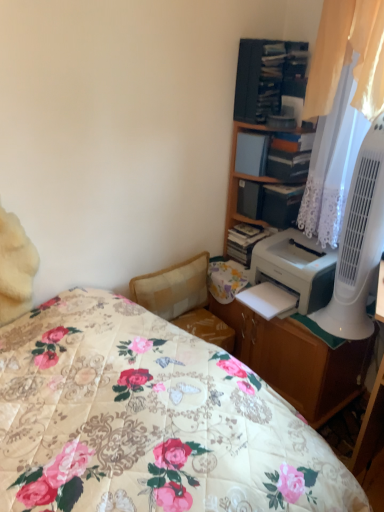
The height and width of the screenshot is (512, 384). Describe the element at coordinates (263, 129) in the screenshot. I see `wooden cabinet at upper right` at that location.

The width and height of the screenshot is (384, 512). In order to click on white lace curtain at upper right in this screenshot , I will do `click(340, 103)`.

Where is `wooden bookshelf at upper right, which appears as the 1th shelf when viewed from the top`? Image resolution: width=384 pixels, height=512 pixels. wooden bookshelf at upper right, which appears as the 1th shelf when viewed from the top is located at coordinates (268, 77).

This screenshot has height=512, width=384. I want to click on wooden cabinet at upper right, so click(x=263, y=129).

From the image's perspective, between white plastic printer at right and hardcover book at upper right, the 1th book viewed from the right, who is located below?

white plastic printer at right is shown below in the image.

Identify the location of printer lying on the left of hardcover book at upper right, the 1th book viewed from the right. (296, 267).

Is the depth of white plastic printer at right less than that of hardcover book at upper right, acting as the 2th book starting from the left?

Yes, it is in front of hardcover book at upper right, acting as the 2th book starting from the left.

Does white plastic printer at right have a greater height compared to hardcover book at upper right, acting as the 2th book starting from the left?

Correct, white plastic printer at right is much taller as hardcover book at upper right, acting as the 2th book starting from the left.

From a real-world perspective, which is physically above, beige fabric swivel chair at center or white plastic fan at right?

white plastic fan at right, from a real-world perspective.

Would you say white plastic fan at right is part of beige fabric swivel chair at center's contents?

No, white plastic fan at right is not inside beige fabric swivel chair at center.

Between beige fabric swivel chair at center and white plastic fan at right, which one appears on the left side from the viewer's perspective?

Positioned to the left is beige fabric swivel chair at center.

Is beige fabric swivel chair at center bigger or smaller than white plastic fan at right?

Clearly, beige fabric swivel chair at center is larger in size than white plastic fan at right.

Can you confirm if wooden cabinet at upper right is taller than beige fabric swivel chair at center?

Indeed, wooden cabinet at upper right has a greater height compared to beige fabric swivel chair at center.

Is wooden cabinet at upper right facing away from beige fabric swivel chair at center?

wooden cabinet at upper right is not turned away from beige fabric swivel chair at center.

Does point (254, 123) appear closer or farther from the camera than point (199, 330)?

Point (254, 123) appears to be closer to the viewer than point (199, 330).

Are wooden bookshelf at upper right, which appears as the second shelf when ordered from the bottom, and white plastic printer at right located far from each other?

No, wooden bookshelf at upper right, which appears as the second shelf when ordered from the bottom, is not far away from white plastic printer at right.

Is point (249, 65) closer or farther from the camera than point (271, 265)?

Clearly, point (249, 65) is closer to the camera than point (271, 265).

From the image's perspective, would you say wooden bookshelf at upper right, which appears as the second shelf when ordered from the bottom, is positioned over white plastic printer at right?

Yes, from the image's perspective, wooden bookshelf at upper right, which appears as the second shelf when ordered from the bottom, is above white plastic printer at right.

Is wooden bookshelf at upper right, which appears as the 1th shelf when viewed from the top, not inside white plastic fan at right?

Answer: Yes, wooden bookshelf at upper right, which appears as the 1th shelf when viewed from the top, is outside of white plastic fan at right.

Considering the relative sizes of wooden bookshelf at upper right, which appears as the second shelf when ordered from the bottom, and white plastic fan at right in the image provided, is wooden bookshelf at upper right, which appears as the second shelf when ordered from the bottom, thinner than white plastic fan at right?

No.

Is point (281, 92) positioned in front of point (373, 178)?

That is False.

Locate an element on the screen. desk located underneath the matte white book at upper right, the first book positioned from the left (from a real-world perspective) is located at coordinates (298, 360).

Considering the positions of objects matte white book at upper right, the first book positioned from the left, and wooden desk at center in the image provided, who is behind, matte white book at upper right, the first book positioned from the left, or wooden desk at center?

matte white book at upper right, the first book positioned from the left, is further from the camera.

From a real-world perspective, which is physically below, matte white book at upper right, the 2th book viewed from the right, or wooden desk at center?

From a 3D spatial view, wooden desk at center is below.

From the image's perspective, relative to wooden desk at center, is matte white book at upper right, the 2th book viewed from the right, above or below?

From the image's perspective, matte white book at upper right, the 2th book viewed from the right, appears above wooden desk at center.

Who is bigger, beige fabric swivel chair at center or wooden cabinet at upper right?

beige fabric swivel chair at center is bigger.

From a real-world perspective, is beige fabric swivel chair at center on top of wooden cabinet at upper right?

No, from a real-world perspective, beige fabric swivel chair at center is not on top of wooden cabinet at upper right.

Is beige fabric swivel chair at center taller or shorter than wooden cabinet at upper right?

In the image, beige fabric swivel chair at center appears to be shorter than wooden cabinet at upper right.

Consider the image. From the image's perspective, would you say beige fabric swivel chair at center is positioned over wooden cabinet at upper right?

No, from the image's perspective, beige fabric swivel chair at center is not over wooden cabinet at upper right.

The width and height of the screenshot is (384, 512). I want to click on printer that is under the hardcover book at upper right, acting as the 2th book starting from the left (from a real-world perspective), so click(x=296, y=267).

Where is `fan positioned vertically above the beige fabric swivel chair at center (from a real-world perspective)`? Image resolution: width=384 pixels, height=512 pixels. fan positioned vertically above the beige fabric swivel chair at center (from a real-world perspective) is located at coordinates (358, 243).

When comparing their distances from white plastic fan at right, does matte white book at upper right, the first book positioned from the left, or white plastic printer at right seem closer?

Among the two, white plastic printer at right is located nearer to white plastic fan at right.

From the picture: Estimate the real-world distances between objects in this image. Which object is closer to white plastic fan at right, wooden desk at center or beige fabric swivel chair at center?

wooden desk at center lies closer to white plastic fan at right than the other object.

Looking at the image, which one is located closer to white plastic fan at right, wooden bookshelf at upper right, which appears as the second shelf when ordered from the bottom, or white plastic printer at right?

white plastic printer at right is positioned closer to the anchor white plastic fan at right.

Estimate the real-world distances between objects in this image. Which object is closer to white plastic fan at right, white lace curtain at upper right or white plastic printer at right?

white plastic printer at right is closer to white plastic fan at right.

Consider the image. Based on their spatial positions, is wooden cabinet at upper right or wooden bookshelf at upper right, which appears as the 1th shelf when viewed from the top, further from white plastic printer at right?

The object further to white plastic printer at right is wooden bookshelf at upper right, which appears as the 1th shelf when viewed from the top.

From the image, which object appears to be nearer to matte plastic shelf at upper right, marked as the 2th shelf in a top-to-bottom arrangement, wooden cabinet at upper right or white plastic fan at right?

wooden cabinet at upper right is positioned closer to the anchor matte plastic shelf at upper right, marked as the 2th shelf in a top-to-bottom arrangement.

Estimate the real-world distances between objects in this image. Which object is further from matte white book at upper right, the first book positioned from the left, white plastic fan at right or matte plastic shelf at upper right, the 1th shelf in the bottom-to-top sequence?

The object further to matte white book at upper right, the first book positioned from the left, is white plastic fan at right.

Which object lies nearer to the anchor point matte plastic shelf at upper right, marked as the 2th shelf in a top-to-bottom arrangement, white plastic fan at right or matte white book at upper right, the 2th book viewed from the right?

matte white book at upper right, the 2th book viewed from the right.

Locate an element on the screen. printer positioned between white plastic fan at right and matte plastic shelf at upper right, marked as the 2th shelf in a top-to-bottom arrangement, from near to far is located at coordinates (296, 267).

Locate an element on the screen. The image size is (384, 512). book between matte white book at upper right, the 2th book viewed from the right, and wooden cabinet at upper right, in the vertical direction is located at coordinates (274, 155).

Where is `curtain between wooden bookshelf at upper right, which appears as the second shelf when ordered from the bottom, and white plastic printer at right, in the vertical direction`? Image resolution: width=384 pixels, height=512 pixels. curtain between wooden bookshelf at upper right, which appears as the second shelf when ordered from the bottom, and white plastic printer at right, in the vertical direction is located at coordinates (340, 103).

Image resolution: width=384 pixels, height=512 pixels. I want to click on shelf that lies between matte white book at upper right, the 2th book viewed from the right, and wooden desk at center from top to bottom, so click(270, 202).